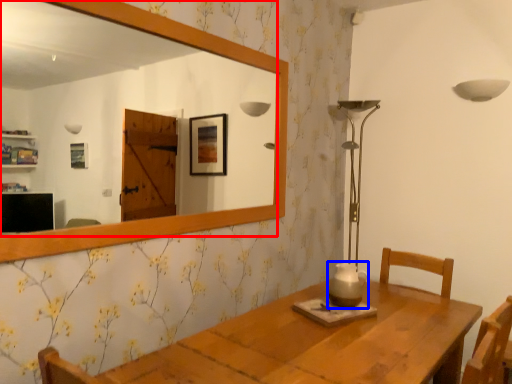
Question: Among these objects, which one is nearest to the camera, mirror (highlighted by a red box) or candle holder (highlighted by a blue box)?

Choices:
 (A) mirror
 (B) candle holder

Answer: (A)